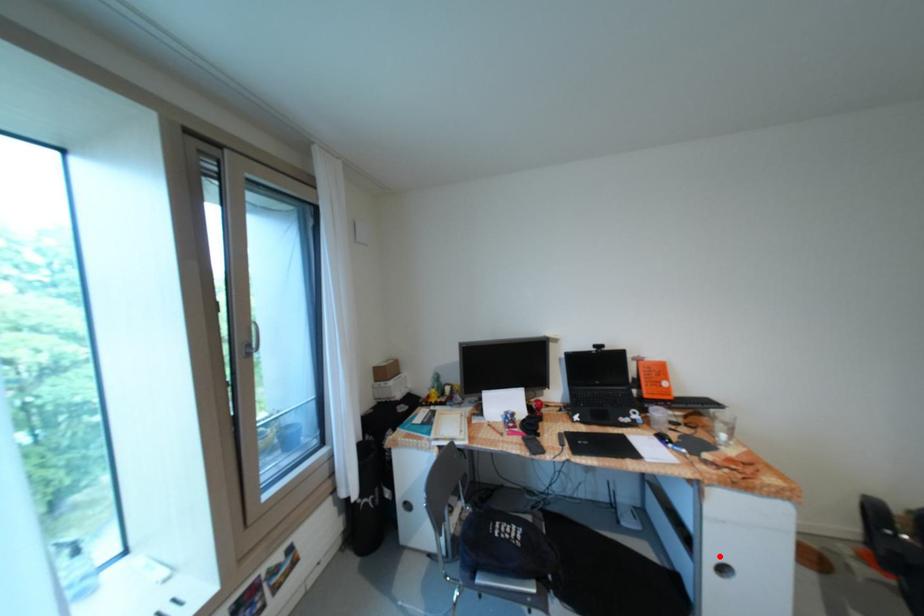
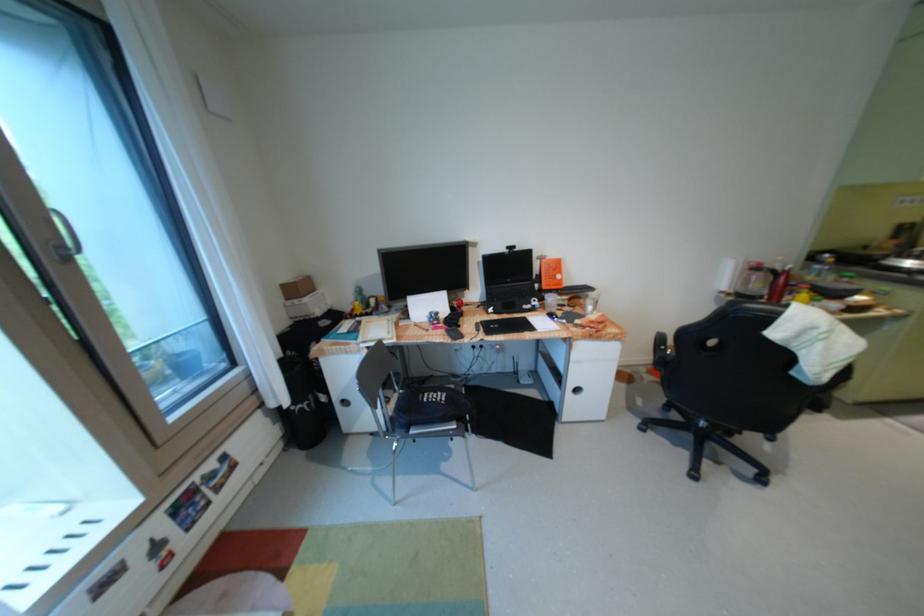
Question: A red point is marked in image1. In image2, is the corresponding 3D point closer to the camera or farther? Reply with the corresponding letter.

Choices:
 (A) The corresponding 3D point is closer.
 (B) The corresponding 3D point is farther.

Answer: (B)